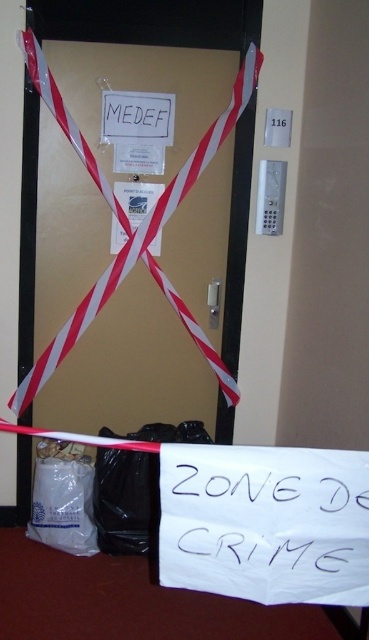
Question: Is white plastic bag at lower left thinner than white paper at center?

Choices:
 (A) yes
 (B) no

Answer: (B)

Question: Does white paper at lower center appear on the right side of white plastic bag at lower left?

Choices:
 (A) yes
 (B) no

Answer: (A)

Question: Which point is closer to the camera?

Choices:
 (A) (156, 124)
 (B) (129, 461)
 (C) (178, 184)
 (D) (71, 502)

Answer: (B)

Question: Which object is the farthest from the white paper at lower center?

Choices:
 (A) red/white striped tape at center
 (B) black plastic bag at lower center
 (C) white paper at center

Answer: (C)

Question: Does black plastic bag at lower center come in front of white plastic bag at lower left?

Choices:
 (A) yes
 (B) no

Answer: (A)

Question: Which object is positioned farthest from the white plastic bag at lower left?

Choices:
 (A) red/white striped tape at center
 (B) black plastic bag at lower center

Answer: (A)